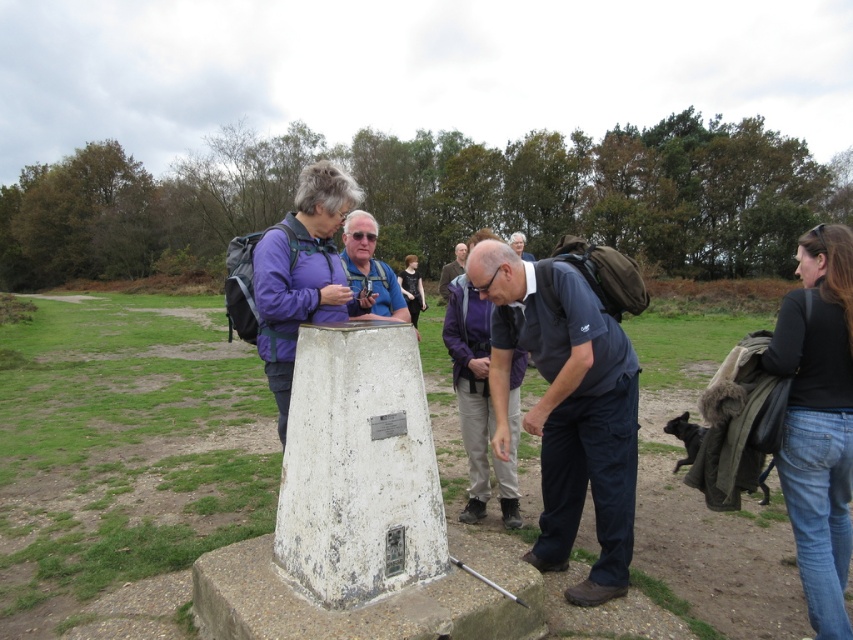
Question: Does white concrete cone at center come in front of dark gray fabric shirt at center?

Choices:
 (A) no
 (B) yes

Answer: (B)

Question: Does purple fabric jacket at center have a smaller size compared to dark brown leather jacket at center?

Choices:
 (A) yes
 (B) no

Answer: (A)

Question: Among these points, which one is nearest to the camera?

Choices:
 (A) (421, 506)
 (B) (267, 280)
 (C) (361, 285)
 (D) (473, 273)

Answer: (A)

Question: Which of the following is the closest to the observer?

Choices:
 (A) (474, 243)
 (B) (506, 346)

Answer: (B)

Question: Which object appears farthest from the camera in this image?

Choices:
 (A) matte gray helmet at center
 (B) dark brown hair at center

Answer: (A)

Question: Is dark blue fabric shirt at center bigger than black denim jeans at lower right?

Choices:
 (A) yes
 (B) no

Answer: (A)